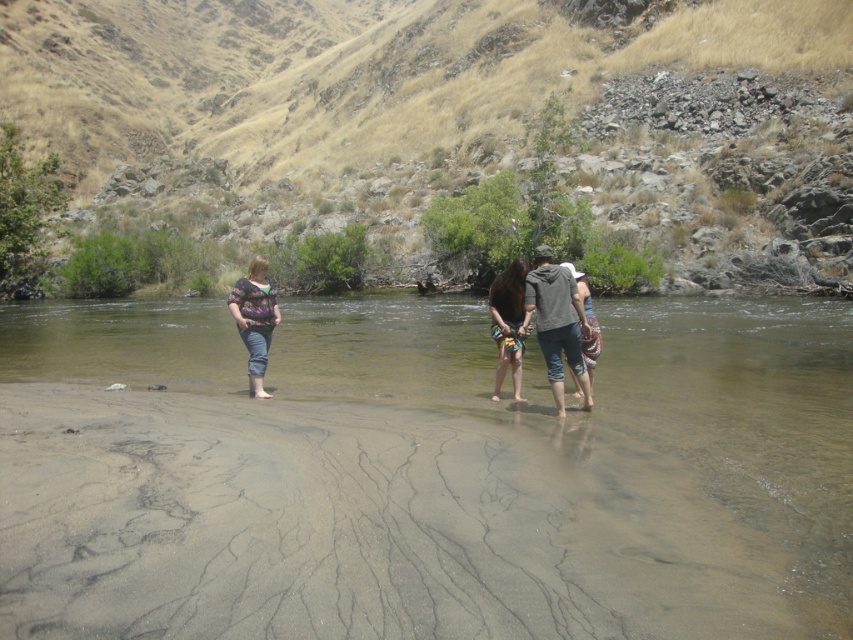
Can you confirm if smooth sand at lower center is thinner than matte floral shirt at center?

Yes, smooth sand at lower center is thinner than matte floral shirt at center.

Who is taller, smooth sand at lower center or matte floral shirt at center?

matte floral shirt at center

Does point (560, 586) come in front of point (264, 300)?

Yes, it is in front of point (264, 300).

Locate an element on the screen. The height and width of the screenshot is (640, 853). smooth sand at lower center is located at coordinates (358, 525).

Does matte floral shirt at center have a greater width compared to multicolored fabric dress at center?

Indeed, matte floral shirt at center has a greater width compared to multicolored fabric dress at center.

Is point (262, 364) less distant than point (508, 272)?

No.

The width and height of the screenshot is (853, 640). What do you see at coordinates (254, 320) in the screenshot? I see `matte floral shirt at center` at bounding box center [254, 320].

This screenshot has width=853, height=640. Find the location of `matte floral shirt at center`. matte floral shirt at center is located at coordinates (254, 320).

Is denim shorts at center bigger than multicolored fabric dress at center?

Indeed, denim shorts at center has a larger size compared to multicolored fabric dress at center.

Find the location of a particular element. Image resolution: width=853 pixels, height=640 pixels. denim shorts at center is located at coordinates (556, 323).

Locate an element on the screen. denim shorts at center is located at coordinates (556, 323).